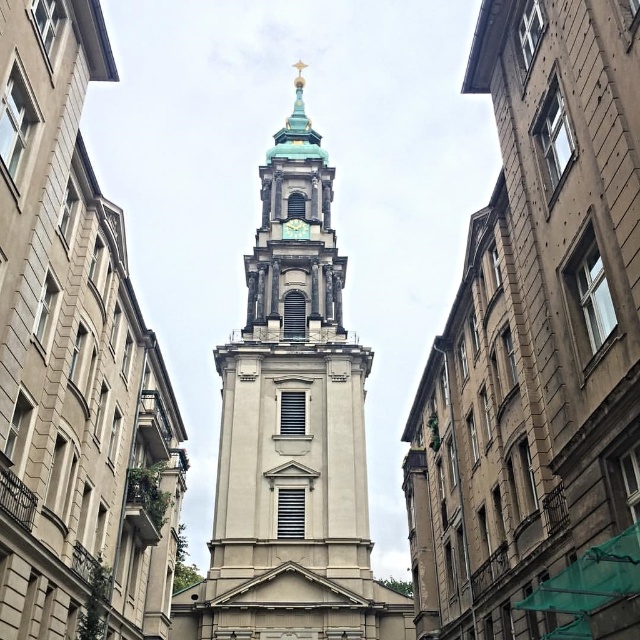
You are standing in front of the church and want to take a photo of the white stone church tower at center and the white stone tower at center. Which one should you pan your camera to the right to capture?

You should pan your camera to the right to capture the white stone tower at center because the white stone church tower at center is to the left of it.

You are a maintenance worker needing to reach both the white stone tower at center and the gold metallic clock at center for repairs. Given that your ladder can only extend to 70 feet, can you safely reach both objects with a single ladder setup?

The white stone tower at center and gold metallic clock at center are 74.89 feet apart from each other, which exceeds the ladder extension limit of 70 feet. Therefore, you cannot safely reach both objects with a single ladder setup.

You are a tourist standing in front of the church. You notice the white stone church tower at center and the gold metallic clock at center. Which object is closer to you?

The white stone church tower at center is closer to you because it is in front of the gold metallic clock at center.